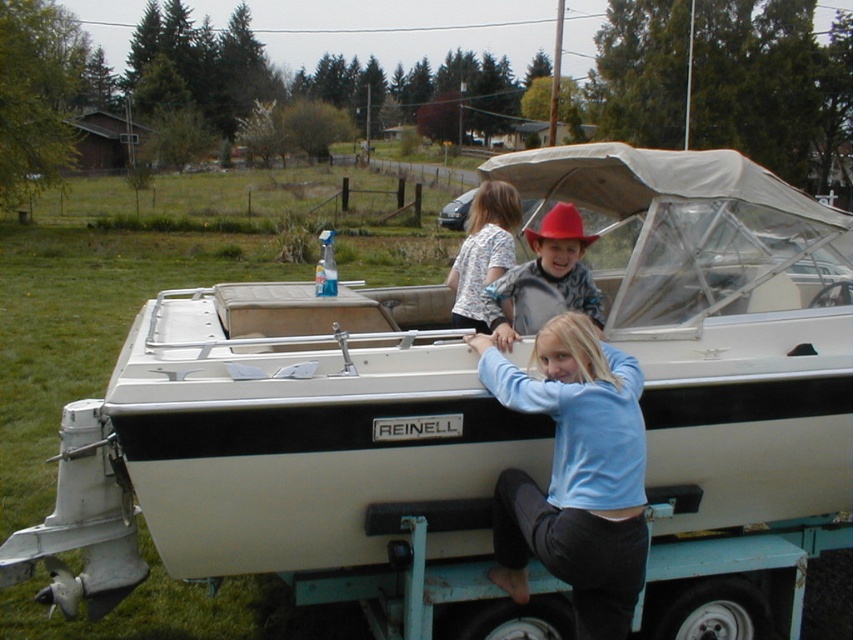
Does point (585, 392) come farther from viewer compared to point (480, 326)?

No.

What are the coordinates of `light blue sweater at center` in the screenshot? It's located at (573, 474).

Which is behind, point (525, 556) or point (514, 252)?

Point (514, 252)

Find the location of a particular element. The image size is (853, 640). light blue sweater at center is located at coordinates (573, 474).

Describe the element at coordinates (544, 280) in the screenshot. This screenshot has height=640, width=853. I see `matte red cowboy hat at center` at that location.

Where is `matte red cowboy hat at center`? matte red cowboy hat at center is located at coordinates (544, 280).

Is point (645, 499) less distant than point (502, 333)?

Yes.

Which is below, light blue sweater at center or matte red cowboy hat at center?

light blue sweater at center

Between point (555, 529) and point (525, 317), which one is positioned behind?

Positioned behind is point (525, 317).

The height and width of the screenshot is (640, 853). What are the coordinates of `light blue sweater at center` in the screenshot? It's located at (573, 474).